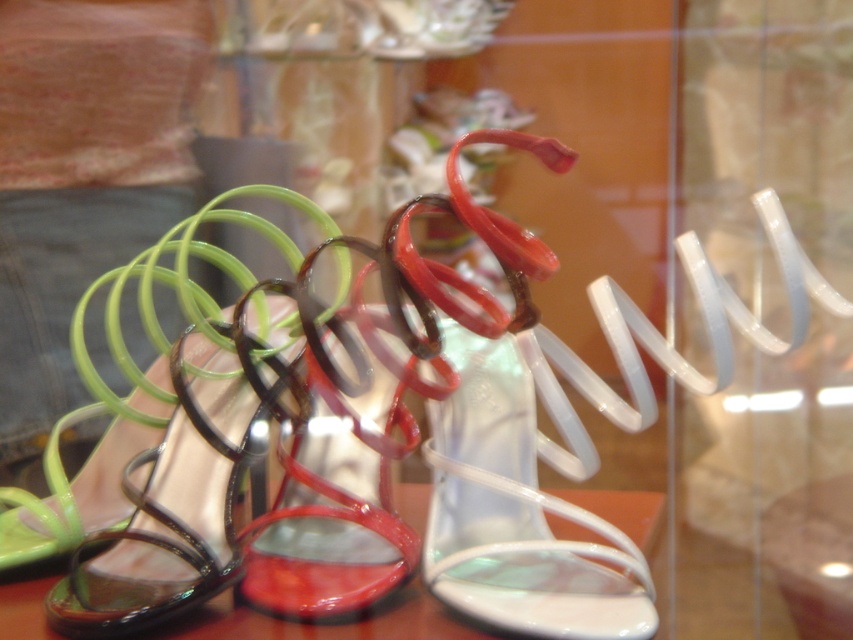
Question: Can you confirm if glossy plastic sandal at center is positioned to the right of green glossy sandal at left?

Choices:
 (A) yes
 (B) no

Answer: (A)

Question: Among these points, which one is nearest to the camera?

Choices:
 (A) (260, 570)
 (B) (149, 579)

Answer: (B)

Question: Is glossy plastic sandal at center to the right of green glossy sandal at left from the viewer's perspective?

Choices:
 (A) yes
 (B) no

Answer: (A)

Question: Among these points, which one is nearest to the camera?

Choices:
 (A) [86, 602]
 (B) [259, 547]

Answer: (A)

Question: From the image, what is the correct spatial relationship of glossy plastic sandal at center in relation to green glossy sandal at left?

Choices:
 (A) below
 (B) above

Answer: (A)